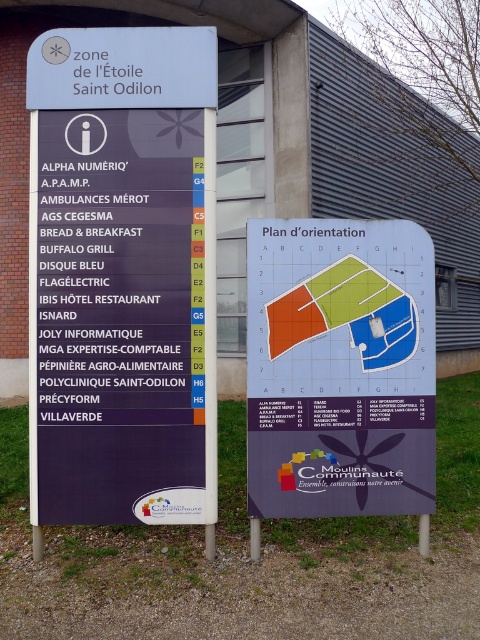
Does purple matte signboard at upper left have a lesser height compared to metallic pole at center?

No.

Is purple matte signboard at upper left in front of metallic pole at center?

Yes, purple matte signboard at upper left is in front of metallic pole at center.

In order to click on purple matte signboard at upper left in this screenshot , I will do `click(122, 276)`.

Locate an element on the screen. The image size is (480, 640). purple matte signboard at upper left is located at coordinates (122, 276).

Identify the location of purple paper map at center. This screenshot has height=640, width=480. (339, 369).

How much distance is there between purple paper map at center and metallic pole at center?

purple paper map at center is 1.05 meters away from metallic pole at center.

Does point (332, 422) come closer to viewer compared to point (421, 548)?

Yes, point (332, 422) is in front of point (421, 548).

At what (x,y) coordinates should I click in order to perform the action: click on purple paper map at center. Please return your answer as a coordinate pair (x, y). Looking at the image, I should click on (339, 369).

Who is positioned more to the right, purple matte signboard at upper left or purple paper map at center?

purple paper map at center

Is purple matte signboard at upper left thinner than purple paper map at center?

Incorrect, purple matte signboard at upper left's width is not less than purple paper map at center's.

Locate an element on the screen. The height and width of the screenshot is (640, 480). purple matte signboard at upper left is located at coordinates (122, 276).